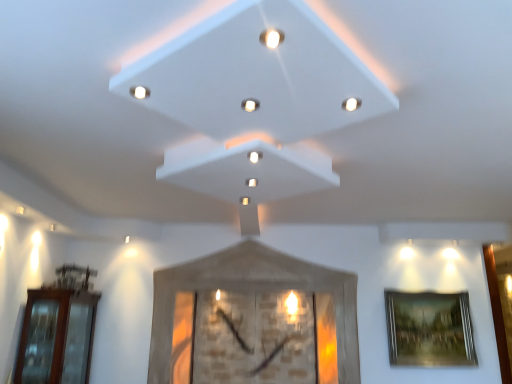
Question: Is white glossy light at center, the fourth light when ordered from front to back, in front of matte white light at upper right, which is the 3th light in bottom-to-top order?

Choices:
 (A) no
 (B) yes

Answer: (A)

Question: From the image's perspective, is white glossy light at center, the fourth light when ordered from front to back, above matte white light at upper right, which is the 3th light in bottom-to-top order?

Choices:
 (A) yes
 (B) no

Answer: (B)

Question: Is white glossy light at center, the fourth light from the top, turned away from matte white light at upper right, which is the 3th light in bottom-to-top order?

Choices:
 (A) no
 (B) yes

Answer: (A)

Question: Would you consider white glossy light at center, the fourth light from the top, to be distant from matte white light at upper right, which is the 3th light in back-to-front order?

Choices:
 (A) yes
 (B) no

Answer: (B)

Question: Considering the relative sizes of white glossy light at center, which is counted as the 1th light, starting from the back, and matte white light at upper right, the first light viewed from the right, in the image provided, is white glossy light at center, which is counted as the 1th light, starting from the back, shorter than matte white light at upper right, the first light viewed from the right,?

Choices:
 (A) no
 (B) yes

Answer: (B)

Question: Considering the relative positions of white glossy light at center, the third light from the right, and white glossy light at upper center, which ranks as the 1th light in top-to-bottom order, in the image provided, is white glossy light at center, the third light from the right, to the left or to the right of white glossy light at upper center, which ranks as the 1th light in top-to-bottom order,?

Choices:
 (A) right
 (B) left

Answer: (A)

Question: In terms of width, does white glossy light at center, the first light positioned from the bottom, look wider or thinner when compared to white glossy light at upper center, the fourth light positioned from the back?

Choices:
 (A) thin
 (B) wide

Answer: (A)

Question: Considering the positions of white glossy light at center, the first light positioned from the bottom, and white glossy light at upper center, the fourth light when ordered from right to left, in the image, is white glossy light at center, the first light positioned from the bottom, taller or shorter than white glossy light at upper center, the fourth light when ordered from right to left,?

Choices:
 (A) short
 (B) tall

Answer: (B)

Question: Does point (256, 180) appear closer or farther from the camera than point (132, 89)?

Choices:
 (A) farther
 (B) closer

Answer: (A)

Question: Considering the positions of gold-framed painting at right and brown glass door at left in the image, is gold-framed painting at right wider or thinner than brown glass door at left?

Choices:
 (A) thin
 (B) wide

Answer: (A)

Question: Considering the positions of gold-framed painting at right and brown glass door at left in the image, is gold-framed painting at right bigger or smaller than brown glass door at left?

Choices:
 (A) small
 (B) big

Answer: (A)

Question: In terms of height, does gold-framed painting at right look taller or shorter compared to brown glass door at left?

Choices:
 (A) tall
 (B) short

Answer: (B)

Question: From a real-world perspective, is gold-framed painting at right positioned above or below brown glass door at left?

Choices:
 (A) above
 (B) below

Answer: (A)

Question: Is brown glass door at left to the left or to the right of matte white light at upper right, the fourth light viewed from the left, in the image?

Choices:
 (A) right
 (B) left

Answer: (B)

Question: Based on their sizes in the image, would you say brown glass door at left is bigger or smaller than matte white light at upper right, which is the 3th light in back-to-front order?

Choices:
 (A) small
 (B) big

Answer: (B)